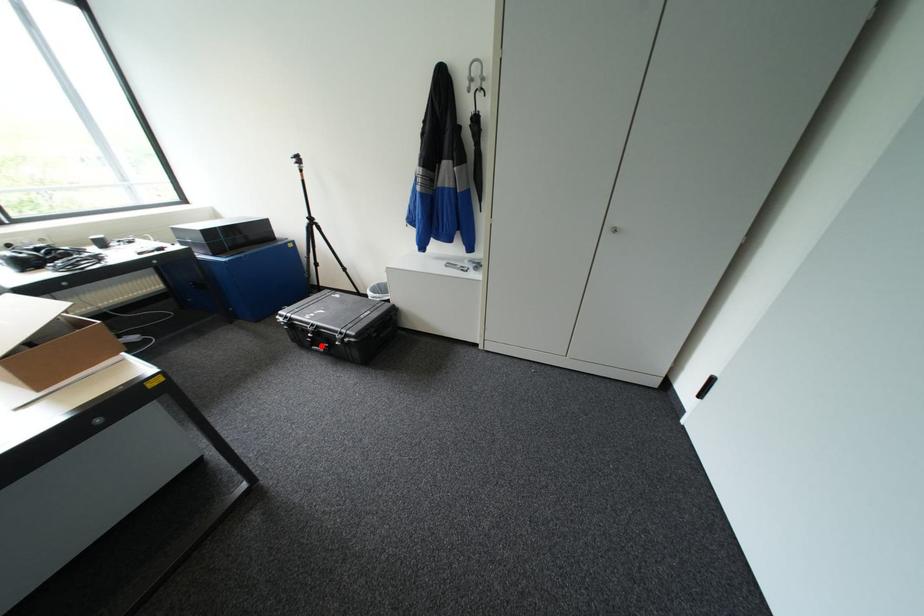
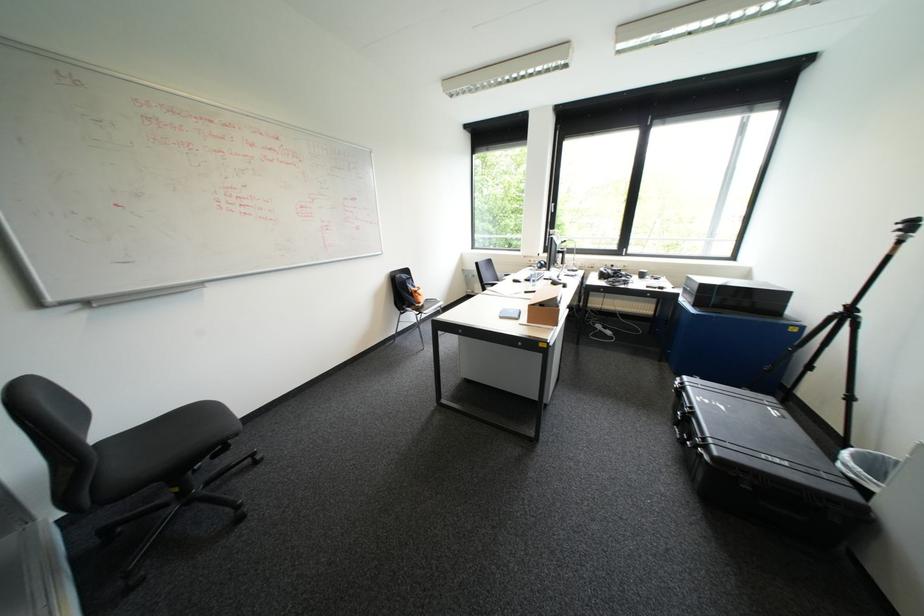
Question: I am providing you with two images of the same scene from different viewpoints. In image1, a red point is highlighted. Considering the same 3D point in image2, which of the following is correct?

Choices:
 (A) It is closer
 (B) It is farther

Answer: (A)